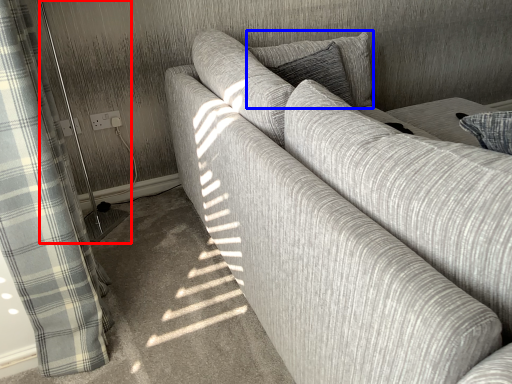
Question: Which point is closer to the camera, screen door (highlighted by a red box) or pillow (highlighted by a blue box)?

Choices:
 (A) screen door
 (B) pillow

Answer: (A)